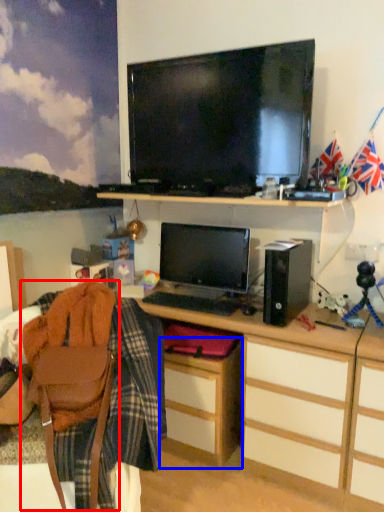
Question: Which object appears closest to the camera in this image, swivel chair (highlighted by a red box) or cabinetry (highlighted by a blue box)?

Choices:
 (A) swivel chair
 (B) cabinetry

Answer: (A)